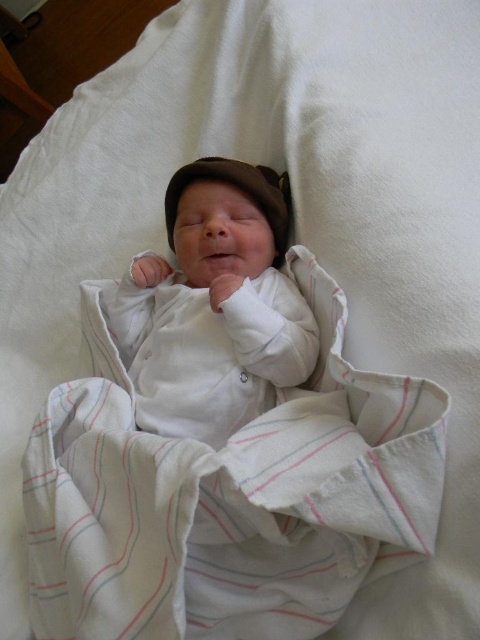
Question: Which point is farther from the camera taking this photo?

Choices:
 (A) (170, 186)
 (B) (180, 282)

Answer: (B)

Question: Can you confirm if white soft fabric newborn at center is smaller than brown fabric hat at center?

Choices:
 (A) yes
 (B) no

Answer: (B)

Question: Is white soft fabric newborn at center smaller than brown fabric hat at center?

Choices:
 (A) yes
 (B) no

Answer: (B)

Question: Can you confirm if white soft fabric newborn at center is thinner than brown fabric hat at center?

Choices:
 (A) yes
 (B) no

Answer: (B)